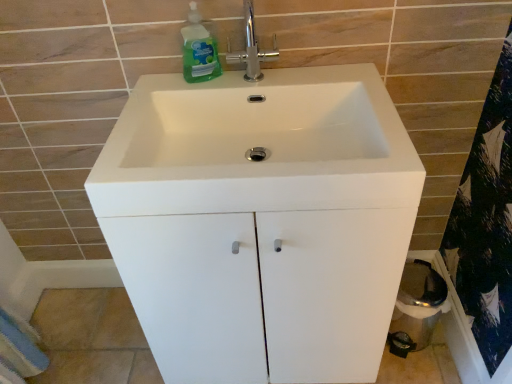
Question: From the image's perspective, relative to white glossy sink at center, is green translucent liquid at upper left above or below?

Choices:
 (A) above
 (B) below

Answer: (A)

Question: Is point (189, 77) closer or farther from the camera than point (288, 127)?

Choices:
 (A) closer
 (B) farther

Answer: (A)

Question: Estimate the real-world distances between objects in this image. Which object is farther from the white glossy cabinet at center?

Choices:
 (A) polished chrome faucet at upper center
 (B) blue textured bath towel at lower left
 (C) green translucent liquid at upper left
 (D) white glossy sink at center

Answer: (B)

Question: Which object is the farthest from the green translucent liquid at upper left?

Choices:
 (A) white glossy cabinet at center
 (B) polished chrome faucet at upper center
 (C) white glossy sink at center
 (D) blue textured bath towel at lower left

Answer: (D)